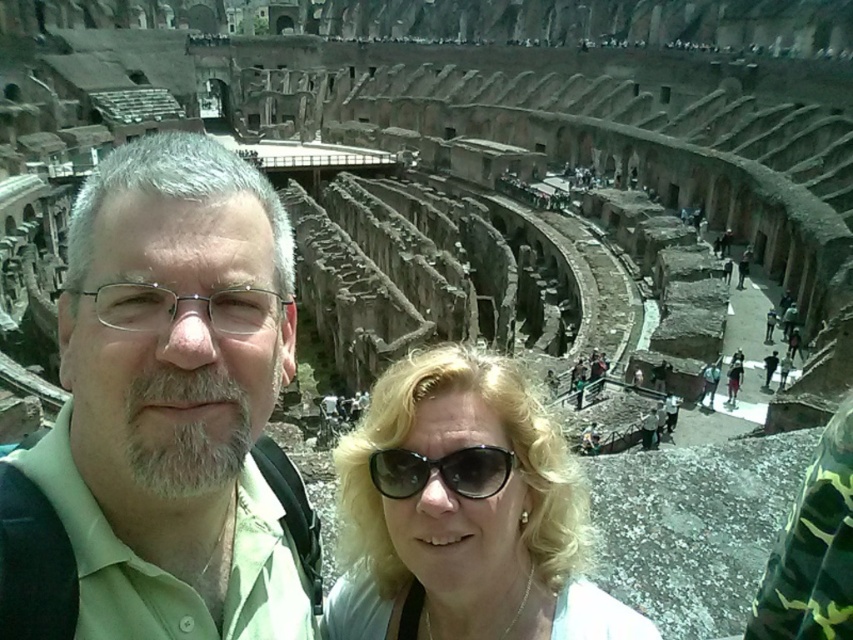
You are at the Colosseum in Rome and want to take a selfie with the famous structure in the background. You are standing at the point marked as point (473, 378). The Colosseum is 54.74 meters away from you. If your camera has a maximum zoom range of 50 meters, can you capture the Colosseum clearly in your selfie?

The distance from point (473, 378) to the camera is 54.74 meters. Since your camera can only zoom up to 50 meters, you cannot capture the Colosseum clearly in your selfie as it is beyond the camera range.

You are a photographer planning to take a group photo of the two people in the scene. The green matte shirt at center and the black plastic sunglasses at center are both in the frame. Based on their positions, which object should be placed closer to the camera to ensure both are in focus?

The green matte shirt at center is much taller than the black plastic sunglasses at center, so to ensure both are in focus, the photographer should place the green matte shirt at center closer to the camera. This adjustment will help balance their sizes in the frame, making both objects appear appropriately scaled relative to each other.

You are a photographer taking a picture of two people at the Colosseum. You notice the green matte shirt at center and the blonde hair at center. Which object should you adjust to ensure both are fully visible in the photo?

The green matte shirt at center is taller than blonde hair at center. To ensure both are fully visible in the photo, you should lower the camera angle slightly so that the taller green matte shirt at center doesn